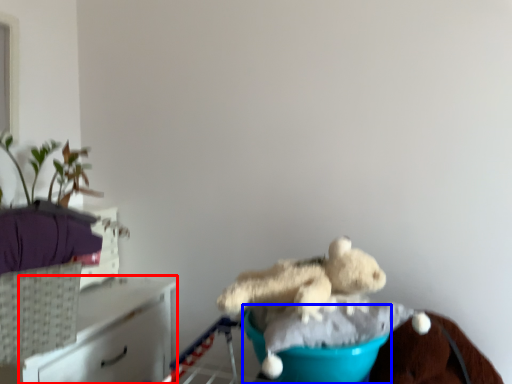
Question: Which object appears closest to the camera in this image, furniture (highlighted by a red box) or teal (highlighted by a blue box)?

Choices:
 (A) furniture
 (B) teal

Answer: (B)